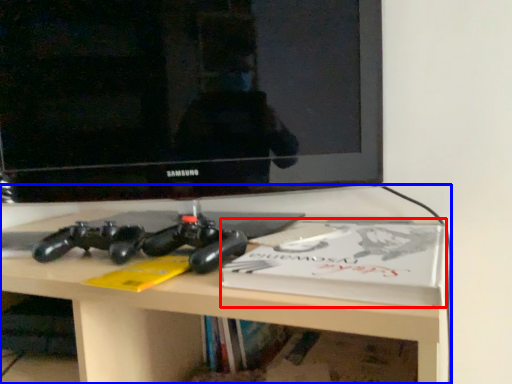
Question: Which point is closer to the camera, paperback book (highlighted by a red box) or desk (highlighted by a blue box)?

Choices:
 (A) paperback book
 (B) desk

Answer: (B)